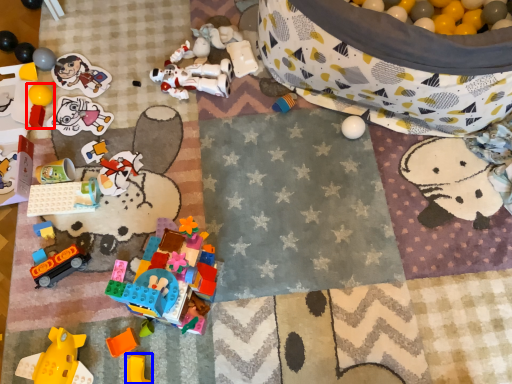
Question: Among these objects, which one is nearest to the camera, toy (highlighted by a red box) or toy (highlighted by a blue box)?

Choices:
 (A) toy
 (B) toy

Answer: (B)